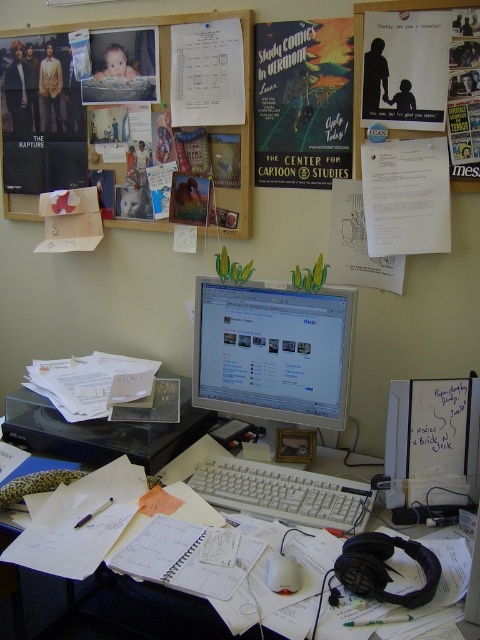
Question: Observing the image, what is the correct spatial positioning of matte paper poster at upper center in reference to white plastic computer desk at center?

Choices:
 (A) left
 (B) right

Answer: (B)

Question: Among these objects, which one is farthest from the camera?

Choices:
 (A) wooden corkboard at upper left
 (B) matte plastic baby at upper left
 (C) white glossy monitor at center
 (D) matte paper poster at upper right

Answer: (B)

Question: Which point is closer to the camera?

Choices:
 (A) matte paper poster at upper center
 (B) white plastic keyboard at center
 (C) matte plastic baby at upper left

Answer: (B)

Question: Can you confirm if white glossy monitor at center is wider than matte paper poster at upper right?

Choices:
 (A) yes
 (B) no

Answer: (A)

Question: Which object is positioned farthest from the matte paper poster at upper center?

Choices:
 (A) wooden corkboard at upper left
 (B) white plastic keyboard at center

Answer: (B)

Question: Can you confirm if matte paper poster at upper right is thinner than matte plastic baby at upper left?

Choices:
 (A) no
 (B) yes

Answer: (B)